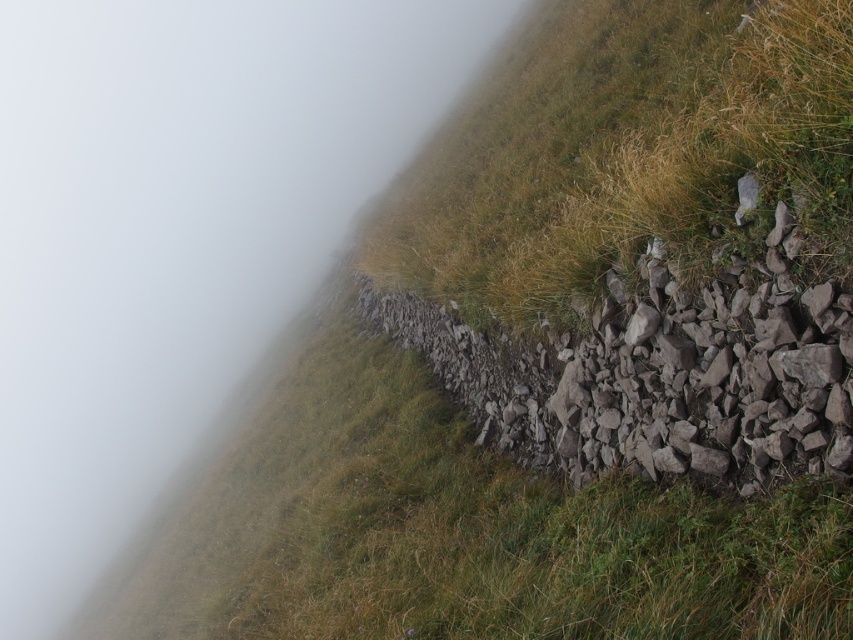
Question: Which of the following is the farthest from the observer?

Choices:
 (A) (537, 384)
 (B) (120, 193)

Answer: (B)

Question: Is white mist at upper left further to camera compared to gray rough stone at right?

Choices:
 (A) yes
 (B) no

Answer: (A)

Question: Which object appears closest to the camera in this image?

Choices:
 (A) white mist at upper left
 (B) gray rough stone at right

Answer: (B)

Question: Does white mist at upper left appear on the left side of gray rough stone at right?

Choices:
 (A) no
 (B) yes

Answer: (B)

Question: Does white mist at upper left have a greater width compared to gray rough stone at right?

Choices:
 (A) no
 (B) yes

Answer: (B)